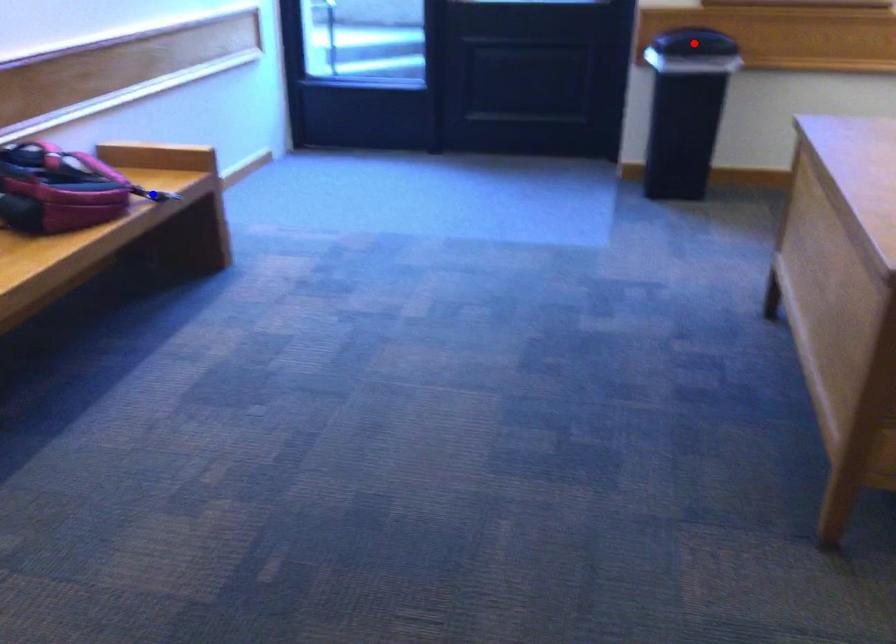
Question: Two points are marked on the image. Which point is closer to the camera?

Choices:
 (A) Blue point is closer.
 (B) Red point is closer.

Answer: (A)